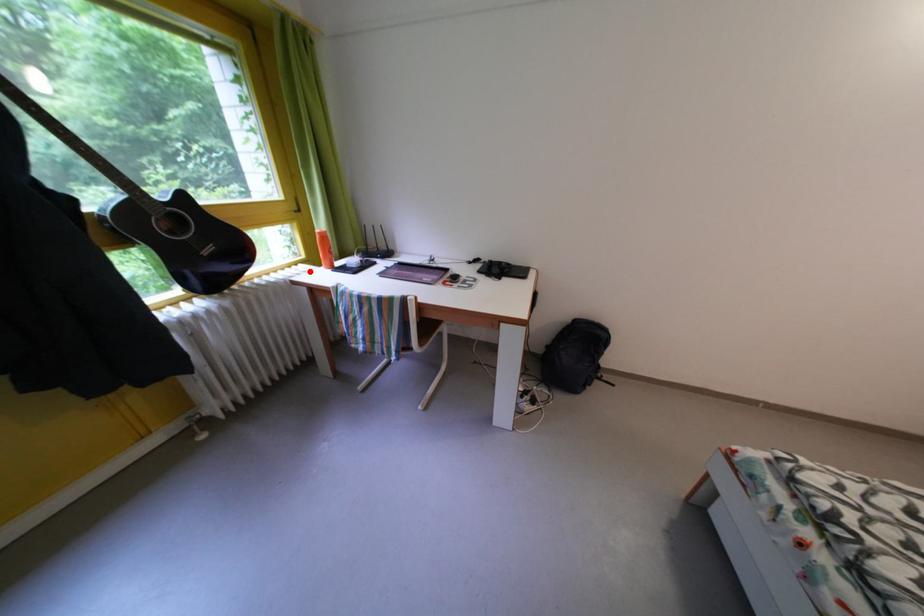
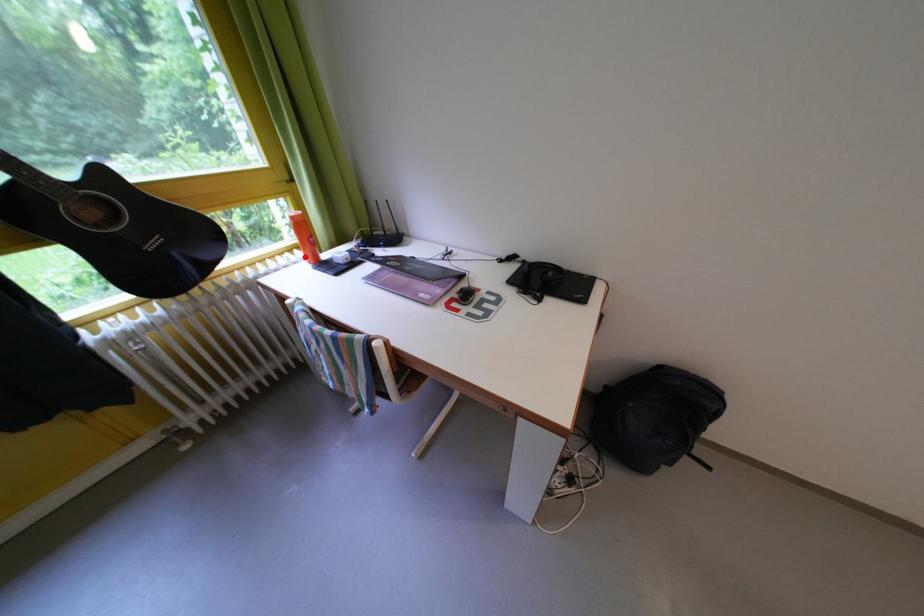
I am providing you with two images of the same scene from different viewpoints. A red point is marked on the first image and another point is marked on the second image. Do the highlighted points in image1 and image2 indicate the same real-world spot?

Yes